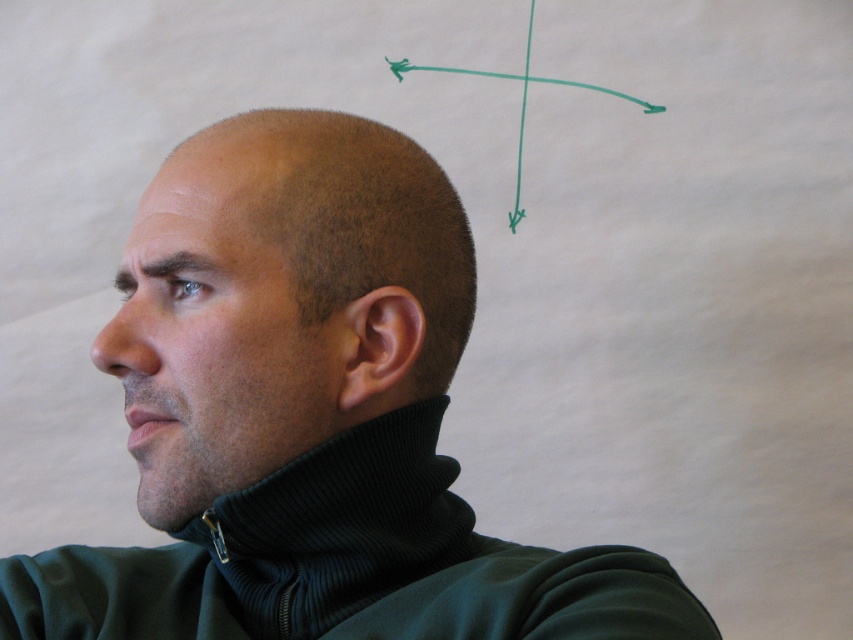
Question: Which object is the closest to the black ribbed turtleneck at center?

Choices:
 (A) black matte head at center
 (B) ribbed dark green sweatshirt at lower left

Answer: (B)

Question: Considering the real-world distances, which object is closest to the dry skin at upper left?

Choices:
 (A) black matte head at center
 (B) black ribbed turtleneck at center
 (C) ribbed dark green sweatshirt at lower left

Answer: (A)

Question: Can you confirm if black ribbed turtleneck at center is bigger than ribbed dark green sweatshirt at lower left?

Choices:
 (A) no
 (B) yes

Answer: (B)

Question: Which of these objects is positioned closest to the black matte head at center?

Choices:
 (A) ribbed dark green sweatshirt at lower left
 (B) black ribbed turtleneck at center

Answer: (B)

Question: Can you confirm if ribbed dark green sweatshirt at lower left is positioned below dry skin at upper left?

Choices:
 (A) no
 (B) yes

Answer: (B)

Question: Is black ribbed turtleneck at center above dry skin at upper left?

Choices:
 (A) yes
 (B) no

Answer: (B)